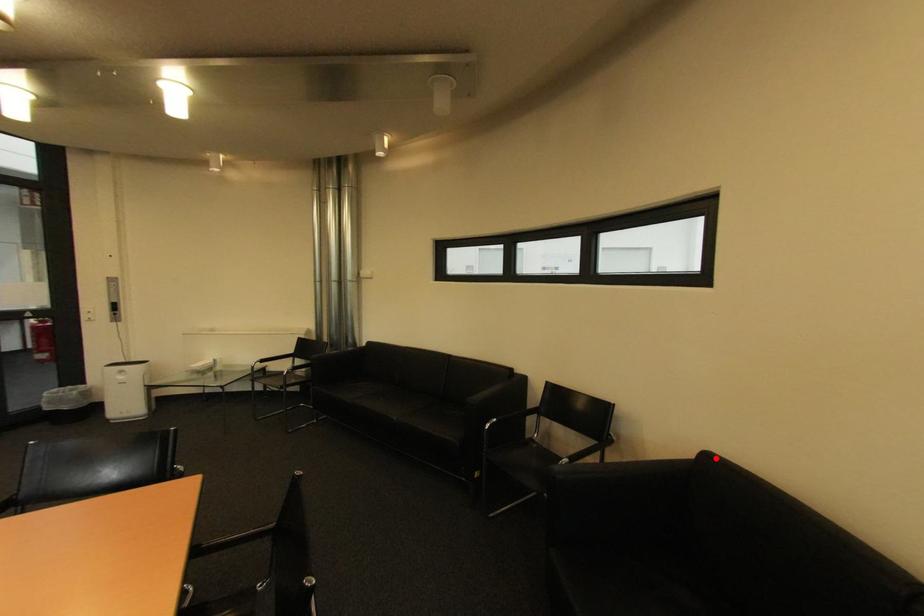
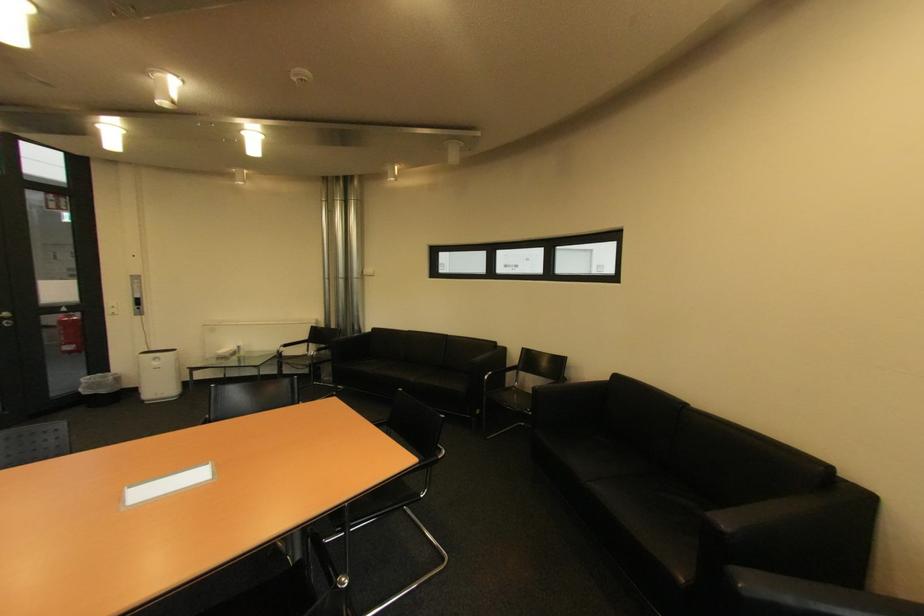
Question: I am providing you with two images of the same scene from different viewpoints. A red point is marked on the first image. At the location where the point appears in image 1, is it still visible in image 2?

Choices:
 (A) Yes
 (B) No

Answer: (A)